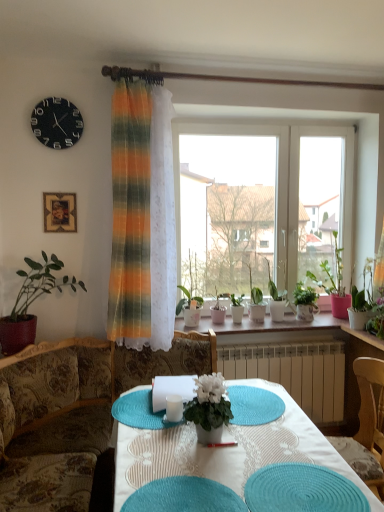
Identify the location of free region under green glossy plant at upper center, which is counted as the 1th houseplant, starting from the back (from a real-world perspective). (284, 321).